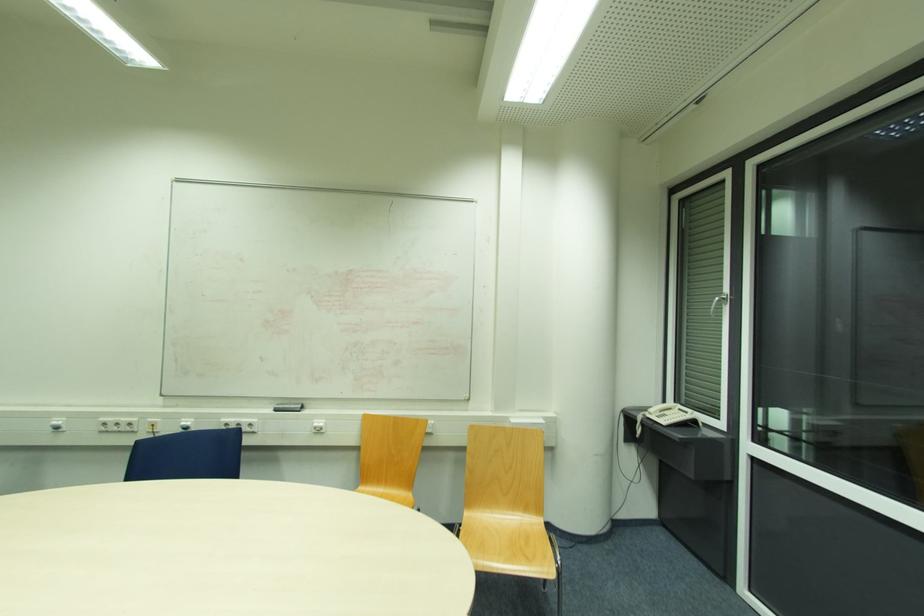
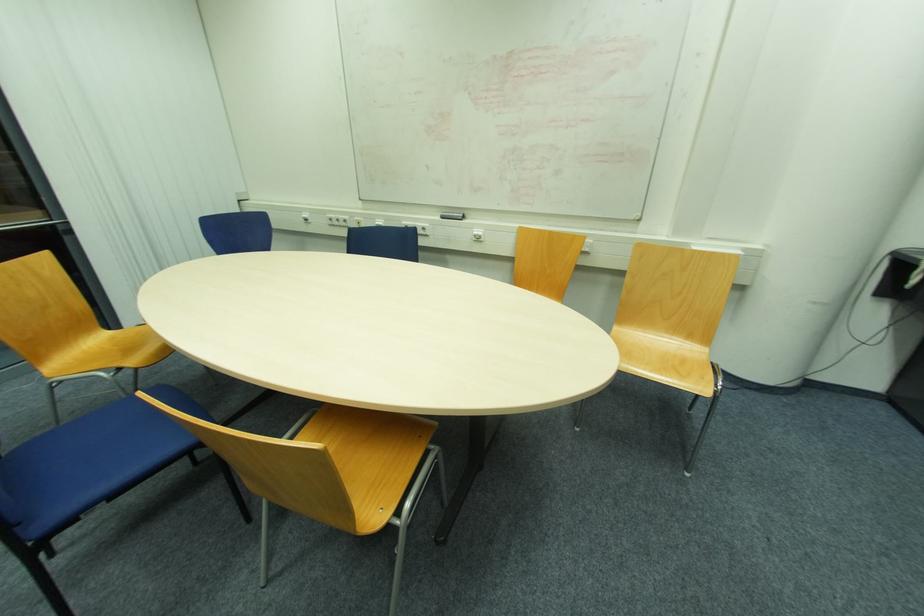
Locate, in the second image, the point that corresponds to (x=276, y=411) in the first image.

(444, 217)